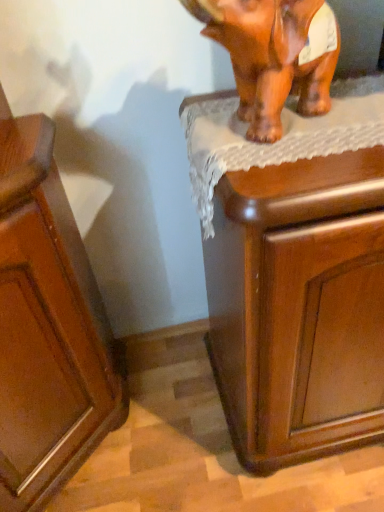
Question: Is wooden cabinet at upper right taller or shorter than glossy wood cabinet at lower left?

Choices:
 (A) short
 (B) tall

Answer: (A)

Question: In the image, is wooden cabinet at upper right on the left side or the right side of glossy wood cabinet at lower left?

Choices:
 (A) right
 (B) left

Answer: (A)

Question: Which is farther from the brown glossy elephant at upper right?

Choices:
 (A) wooden cabinet at upper right
 (B) glossy wood cabinet at lower left

Answer: (B)

Question: Estimate the real-world distances between objects in this image. Which object is closer to the glossy wood cabinet at lower left?

Choices:
 (A) wooden cabinet at upper right
 (B) brown glossy elephant at upper right

Answer: (A)